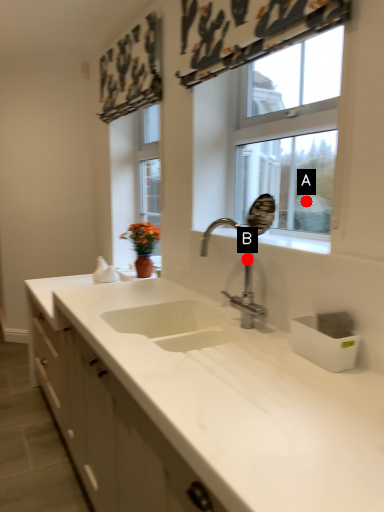
Question: Two points are circled on the image, labeled by A and B beside each circle. Among these points, which one is nearest to the camera?

Choices:
 (A) A is closer
 (B) B is closer

Answer: (B)